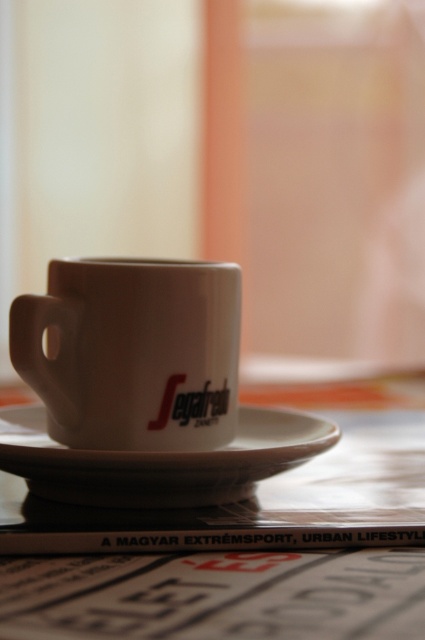
Question: Is white glossy table at center wider than white matte mug at center?

Choices:
 (A) yes
 (B) no

Answer: (A)

Question: Is white glossy table at center positioned before white ceramic saucer at center?

Choices:
 (A) yes
 (B) no

Answer: (A)

Question: Which point is farther from the camera taking this photo?

Choices:
 (A) (237, 460)
 (B) (274, 481)

Answer: (B)

Question: Which of the following is the farthest from the observer?

Choices:
 (A) (104, 259)
 (B) (158, 461)

Answer: (A)

Question: Estimate the real-world distances between objects in this image. Which object is farther from the white ceramic saucer at center?

Choices:
 (A) white matte mug at center
 (B) white glossy table at center

Answer: (B)

Question: Observing the image, what is the correct spatial positioning of white glossy table at center in reference to white matte mug at center?

Choices:
 (A) left
 (B) right

Answer: (B)